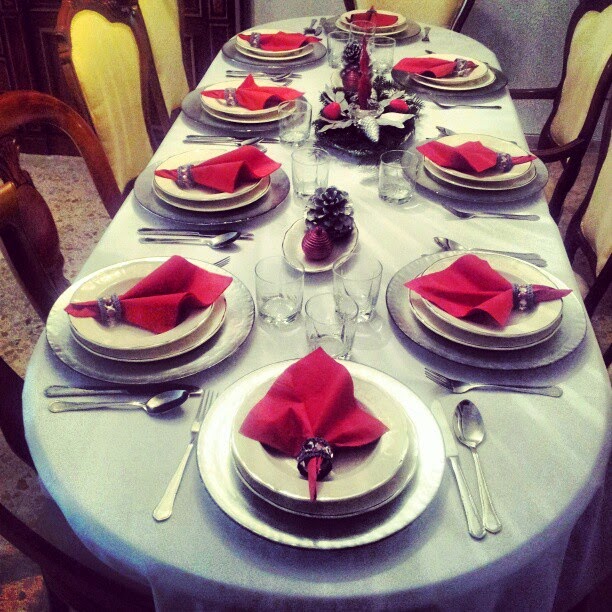
Find the location of a particular element. The width and height of the screenshot is (612, 612). chairs is located at coordinates (32, 222), (91, 70), (174, 19), (418, 5), (589, 73), (610, 217).